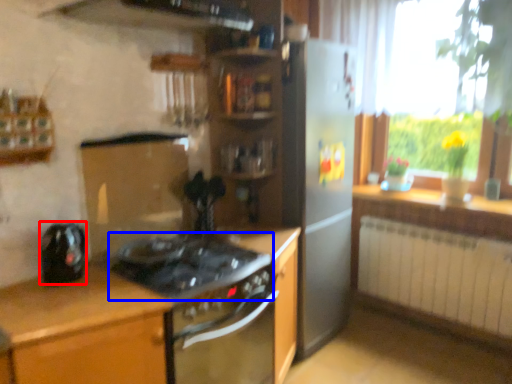
Question: Which object appears closest to the camera in this image, kitchen appliance (highlighted by a red box) or gas stove (highlighted by a blue box)?

Choices:
 (A) kitchen appliance
 (B) gas stove

Answer: (B)